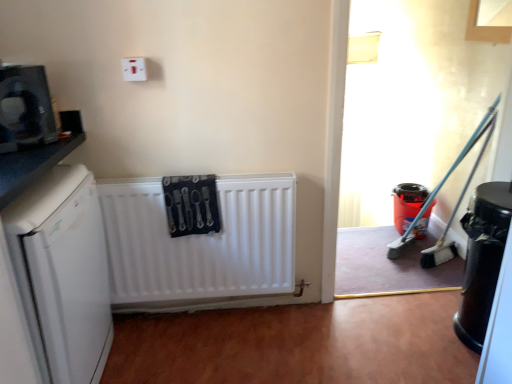
You are a GUI agent. You are given a task and a screenshot of the screen. Output one action in this format:
    pyautogui.click(x=<x>, y=<y>)
    Task: Click on the free point to the left of black glossy trash can at lower right, the 2th appliance positioned from the right
    
    Given the screenshot: What is the action you would take?
    pyautogui.click(x=416, y=339)